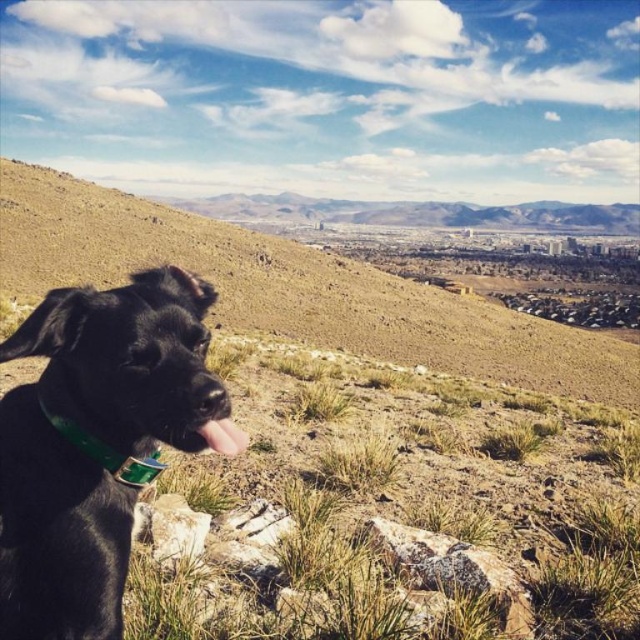
You are standing in the middle of the rocky, grassy hillside where the black dog is sitting. You notice two points marked in the scene. Which point is closer to you, point (131, 314) or point (488, 339)?

Point (131, 314) is closer to the viewer than point (488, 339).

You are a hiker who wants to take a photo of the shiny black dog at lower left and the brown grassy hillside at lower left. Based on their sizes, which one should you focus on first to ensure both are in the frame?

The shiny black dog at lower left is smaller than the brown grassy hillside at lower left. To ensure both are in the frame, focus on the shiny black dog at lower left first since it is smaller and might require closer attention to capture details, while the hillside will naturally fill the background.